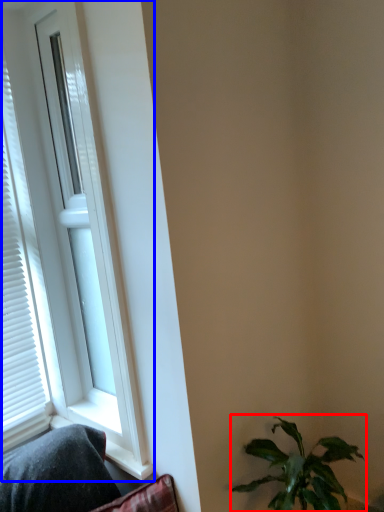
Question: Which of the following is the closest to the observer, houseplant (highlighted by a red box) or window (highlighted by a blue box)?

Choices:
 (A) houseplant
 (B) window

Answer: (A)